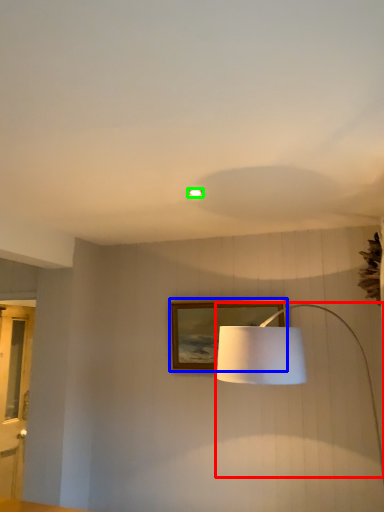
Question: Which object is the closest to the lamp (highlighted by a red box)? Choose among these: picture frame (highlighted by a blue box) or lighting (highlighted by a green box).

Choices:
 (A) picture frame
 (B) lighting

Answer: (B)